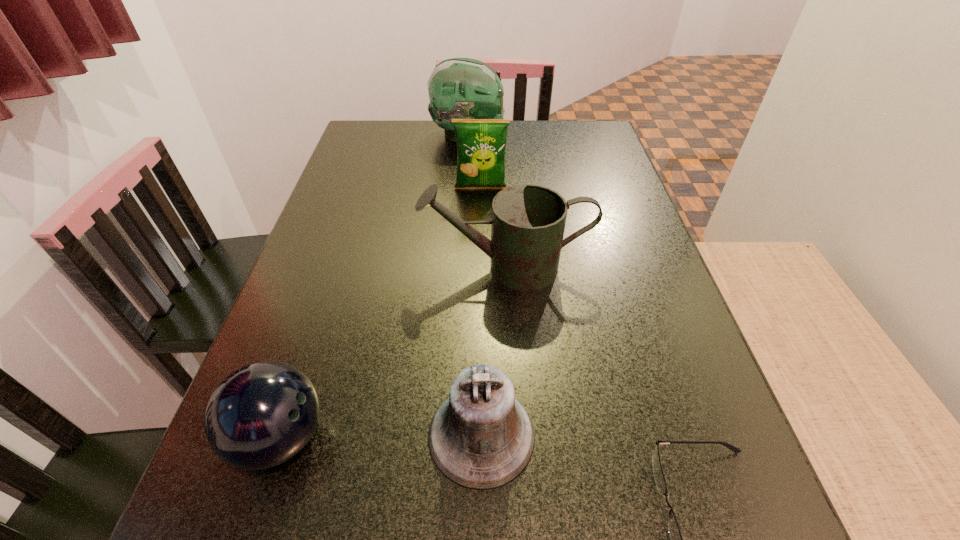
At what (x,y) coordinates should I click in order to perform the action: click on the farthest object. Please return your answer as a coordinate pair (x, y). The height and width of the screenshot is (540, 960). Looking at the image, I should click on (459, 88).

This screenshot has width=960, height=540. What are the coordinates of `the third farthest object` in the screenshot? It's located at (528, 221).

At what (x,y) coordinates should I click in order to perform the action: click on crisp (potato chip). Please return your answer as a coordinate pair (x, y). Looking at the image, I should click on (481, 143).

At what (x,y) coordinates should I click in order to perform the action: click on bell. Please return your answer as a coordinate pair (x, y). This screenshot has width=960, height=540. Looking at the image, I should click on (481, 437).

This screenshot has width=960, height=540. What are the coordinates of `bowling ball` in the screenshot? It's located at (260, 416).

The width and height of the screenshot is (960, 540). I want to click on free spot located on the visor of the farthest object, so click(x=598, y=135).

Where is `vacant region located 0.210m with the spout on the watering can`? vacant region located 0.210m with the spout on the watering can is located at coordinates (324, 267).

What are the coordinates of `vacant space located with the spout on the watering can` in the screenshot? It's located at (300, 267).

Where is `blank space located 0.130m with the spout on the watering can`? This screenshot has width=960, height=540. blank space located 0.130m with the spout on the watering can is located at coordinates (362, 267).

Locate an element on the screen. vacant region located on the front-facing side of the second farthest object is located at coordinates (481, 220).